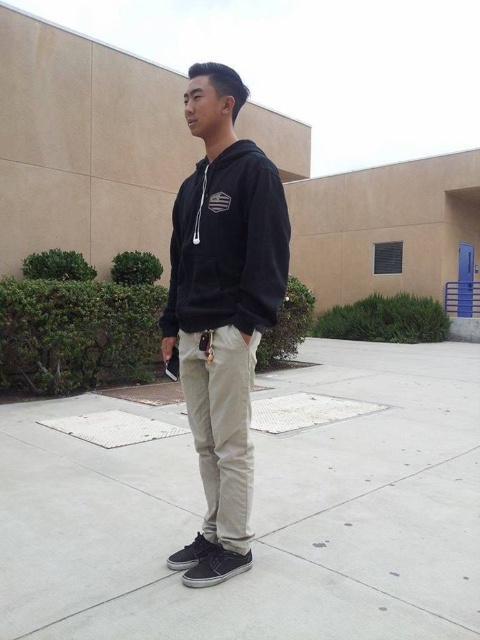
You are a delivery robot trying to navigate to the blue door with a metal railing. The point at coordinates (259, 515) is in your path. What type of terrain is at that point?

The point at coordinates (259, 515) corresponds to concrete at center, so the terrain there is concrete.

You are a delivery person trying to place a small package on the ground. You see the concrete at center and the black cotton hoodie at center. Which surface can you place the package on?

The concrete at center has a lesser height compared to the black cotton hoodie at center, so the package can be placed on the concrete at center since it is a stable, lower surface.